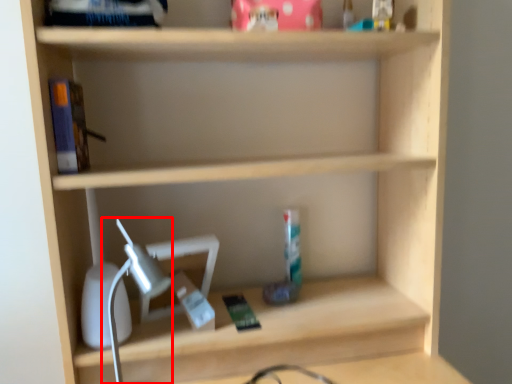
Question: Observing the image, what is the correct spatial positioning of table lamp (annotated by the red box) in reference to book?

Choices:
 (A) left
 (B) right

Answer: (B)